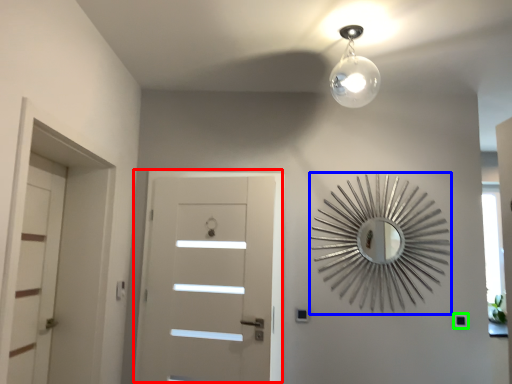
Question: Which object is positioned closest to door (highlighted by a red box)? Select from design (highlighted by a blue box) and light switch (highlighted by a green box).

Choices:
 (A) design
 (B) light switch

Answer: (A)